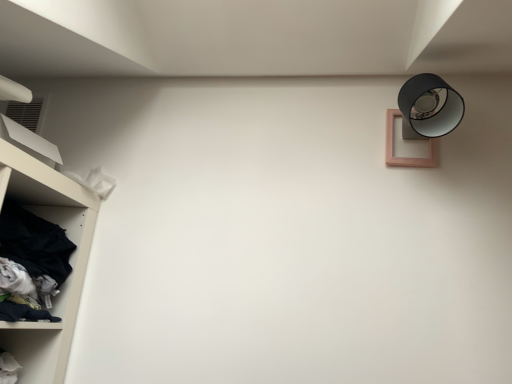
The height and width of the screenshot is (384, 512). What do you see at coordinates (30, 264) in the screenshot?
I see `dark gray fabric at left` at bounding box center [30, 264].

Measure the distance between point (32, 269) and camera.

1.09 meters.

Find the location of `dark gray fabric at left`. dark gray fabric at left is located at coordinates (30, 264).

At what (x,y) coordinates should I click in order to perform the action: click on dark gray fabric at left. Please return your answer as a coordinate pair (x, y). This screenshot has width=512, height=384. Looking at the image, I should click on (30, 264).